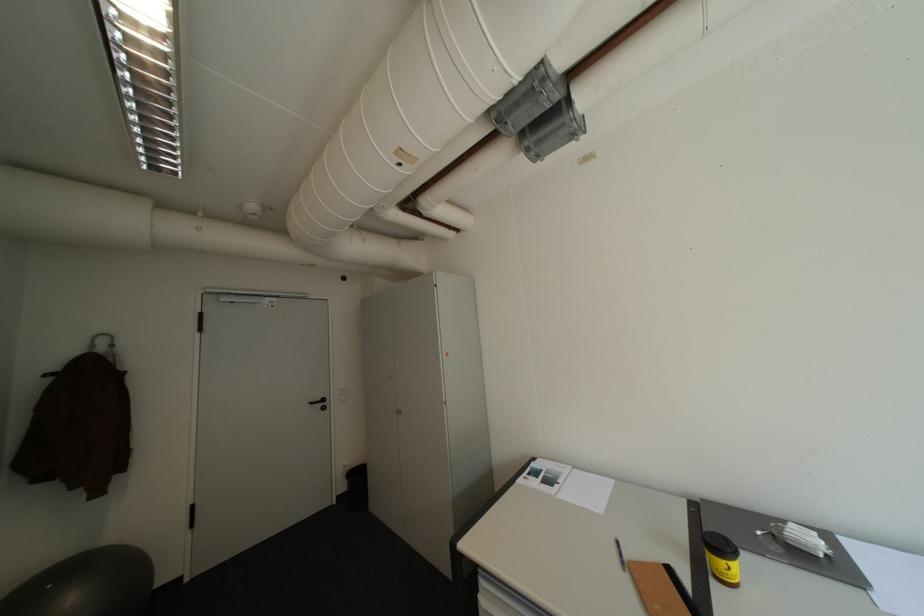
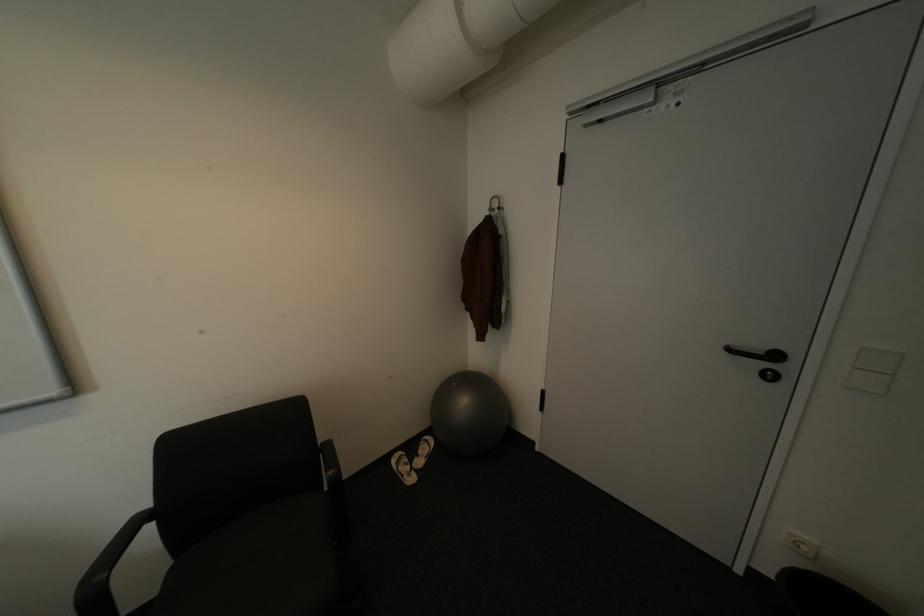
The point at (59, 586) is marked in the first image. Where is the corresponding point in the second image?

(464, 384)